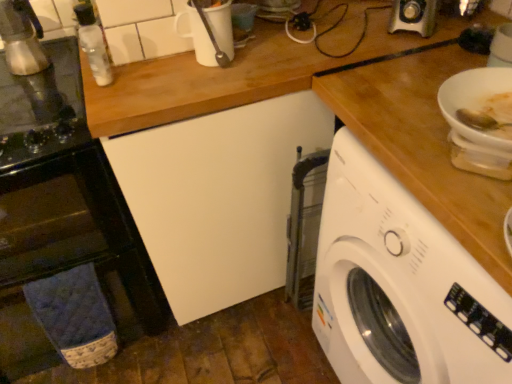
This screenshot has width=512, height=384. What do you see at coordinates (79, 236) in the screenshot?
I see `blue fabric oven towel at lower left` at bounding box center [79, 236].

In order to click on blue fabric oven towel at lower left in this screenshot , I will do `click(79, 236)`.

Locate an element on the screen. white plastic washing machine at right is located at coordinates (400, 286).

Find the location of a particular element. This screenshot has width=512, height=384. metallic silver espresso maker at left, arranged as the 2th appliance when ordered from the bottom is located at coordinates (22, 38).

In order to face metallic silver coffee maker at left, which is the 1th appliance from bottom to top, should I rotate leftwards or rightwards?

You should rotate left by 27.788 degrees.

At what (x,y) coordinates should I click in order to perform the action: click on blue fabric oven towel at lower left. Please return your answer as a coordinate pair (x, y). The image size is (512, 384). Looking at the image, I should click on (79, 236).

Can you see metallic silver espresso maker at left, arranged as the 2th appliance when ordered from the bottom, touching clear glass bottle at upper left?

No, metallic silver espresso maker at left, arranged as the 2th appliance when ordered from the bottom, is not with clear glass bottle at upper left.

Is point (20, 18) more distant than point (80, 29)?

Yes, it is behind point (80, 29).

What's the angular difference between metallic silver espresso maker at left, arranged as the 2th appliance when ordered from the bottom, and clear glass bottle at upper left's facing directions?

metallic silver espresso maker at left, arranged as the 2th appliance when ordered from the bottom, and clear glass bottle at upper left are facing 87.1 degrees away from each other.

Does metallic silver espresso maker at left, the first appliance in the top-to-bottom sequence, have a lesser width compared to clear glass bottle at upper left?

Incorrect, the width of metallic silver espresso maker at left, the first appliance in the top-to-bottom sequence, is not less than that of clear glass bottle at upper left.

In the scene shown: Which of these two, blue fabric oven towel at lower left or white matte bowl at upper right, stands taller?

blue fabric oven towel at lower left.

From a real-world perspective, is blue fabric oven towel at lower left under white matte bowl at upper right?

Yes, from a real-world perspective, blue fabric oven towel at lower left is below white matte bowl at upper right.

From the image's perspective, would you say blue fabric oven towel at lower left is positioned over white matte bowl at upper right?

Actually, blue fabric oven towel at lower left appears below white matte bowl at upper right in the image.

Considering the sizes of objects white plastic washing machine at right and metallic silver espresso maker at left, arranged as the 2th appliance when ordered from the bottom, in the image provided, who is thinner, white plastic washing machine at right or metallic silver espresso maker at left, arranged as the 2th appliance when ordered from the bottom,?

With smaller width is metallic silver espresso maker at left, arranged as the 2th appliance when ordered from the bottom.

Which appliance is the 2nd one when counting from the left side of the white plastic washing machine at right? Please provide its 2D coordinates.

[(22, 38)]

Would you say white plastic washing machine at right is to the left or to the right of metallic silver espresso maker at left, arranged as the 2th appliance when ordered from the bottom, in the picture?

In the image, white plastic washing machine at right appears on the right side of metallic silver espresso maker at left, arranged as the 2th appliance when ordered from the bottom.

Which is farther, (328, 337) or (23, 65)?

The point (328, 337) is more distant.

Are white plastic washing machine at right and metallic silver coffee maker at left, placed as the second appliance when sorted from top to bottom, located far from each other?

They are positioned close to each other.

Does point (447, 352) come in front of point (42, 81)?

That is True.

From the image's perspective, is white plastic washing machine at right located above or below metallic silver coffee maker at left, which is the 1th appliance from bottom to top?

Based on their image positions, white plastic washing machine at right is located beneath metallic silver coffee maker at left, which is the 1th appliance from bottom to top.

From the image's perspective, which object appears higher, white matte bowl at upper right or clear glass bottle at upper left?

clear glass bottle at upper left.

In terms of height, does white matte bowl at upper right look taller or shorter compared to clear glass bottle at upper left?

white matte bowl at upper right is shorter than clear glass bottle at upper left.

Measure the distance from white matte bowl at upper right to clear glass bottle at upper left.

A distance of 31.55 inches exists between white matte bowl at upper right and clear glass bottle at upper left.

How many degrees apart are the facing directions of white matte bowl at upper right and clear glass bottle at upper left?

The angle between the facing direction of white matte bowl at upper right and the facing direction of clear glass bottle at upper left is 9.02 degrees.

Is metallic silver coffee maker at left, which is the 1th appliance from bottom to top, oriented towards metallic silver espresso maker at left, the first appliance in the top-to-bottom sequence?

No, metallic silver coffee maker at left, which is the 1th appliance from bottom to top, is not turned towards metallic silver espresso maker at left, the first appliance in the top-to-bottom sequence.

Is point (75, 62) closer to camera compared to point (12, 9)?

No, it is not.

Does metallic silver coffee maker at left, which is the 1th appliance from bottom to top, appear on the right side of metallic silver espresso maker at left, arranged as the 2th appliance when ordered from the bottom?

Yes, metallic silver coffee maker at left, which is the 1th appliance from bottom to top, is to the right of metallic silver espresso maker at left, arranged as the 2th appliance when ordered from the bottom.

Considering the sizes of objects metallic silver coffee maker at left, placed as the second appliance when sorted from top to bottom, and metallic silver espresso maker at left, the first appliance in the top-to-bottom sequence, in the image provided, who is thinner, metallic silver coffee maker at left, placed as the second appliance when sorted from top to bottom, or metallic silver espresso maker at left, the first appliance in the top-to-bottom sequence,?

metallic silver espresso maker at left, the first appliance in the top-to-bottom sequence, is thinner.

Is white plastic washing machine at right far from blue fabric oven towel at lower left?

No, white plastic washing machine at right is not far away from blue fabric oven towel at lower left.

Locate an element on the screen. The image size is (512, 384). oven above the white plastic washing machine at right (from the image's perspective) is located at coordinates (79, 236).

From the picture: Is white plastic washing machine at right not inside blue fabric oven towel at lower left?

That's correct, white plastic washing machine at right is outside of blue fabric oven towel at lower left.

Find the location of a particular element. appliance above the clear glass bottle at upper left (from the image's perspective) is located at coordinates (22, 38).

Locate an element on the screen. oven that appears below the white matte bowl at upper right (from the image's perspective) is located at coordinates (79, 236).

From the image, which object appears to be nearer to metallic silver espresso maker at left, the first appliance in the top-to-bottom sequence, white matte bowl at upper right or blue fabric oven towel at lower left?

blue fabric oven towel at lower left lies closer to metallic silver espresso maker at left, the first appliance in the top-to-bottom sequence, than the other object.

When comparing their distances from white plastic washing machine at right, does metallic silver coffee maker at left, placed as the second appliance when sorted from top to bottom, or metallic silver espresso maker at left, the first appliance in the top-to-bottom sequence, seem closer?

Based on the image, metallic silver coffee maker at left, placed as the second appliance when sorted from top to bottom, appears to be nearer to white plastic washing machine at right.

When comparing their distances from white matte bowl at upper right, does metallic silver espresso maker at left, arranged as the 2th appliance when ordered from the bottom, or clear glass bottle at upper left seem further?

metallic silver espresso maker at left, arranged as the 2th appliance when ordered from the bottom, is positioned further to the anchor white matte bowl at upper right.

Based on the photo, which object lies further to the anchor point clear glass bottle at upper left, white plastic washing machine at right or metallic silver coffee maker at left, placed as the second appliance when sorted from top to bottom?

white plastic washing machine at right is further to clear glass bottle at upper left.

Considering their positions, is blue fabric oven towel at lower left positioned closer to white plastic washing machine at right than clear glass bottle at upper left?

blue fabric oven towel at lower left is positioned closer to the anchor white plastic washing machine at right.

Based on their spatial positions, is metallic silver coffee maker at left, placed as the second appliance when sorted from top to bottom, or metallic silver espresso maker at left, the first appliance in the top-to-bottom sequence, further from blue fabric oven towel at lower left?

metallic silver espresso maker at left, the first appliance in the top-to-bottom sequence.

Based on the photo, when comparing their distances from metallic silver espresso maker at left, the first appliance in the top-to-bottom sequence, does clear glass bottle at upper left or white plastic washing machine at right seem closer?

clear glass bottle at upper left is closer to metallic silver espresso maker at left, the first appliance in the top-to-bottom sequence.

Which object lies further to the anchor point white plastic washing machine at right, metallic silver espresso maker at left, arranged as the 2th appliance when ordered from the bottom, or metallic silver coffee maker at left, placed as the second appliance when sorted from top to bottom?

The object further to white plastic washing machine at right is metallic silver espresso maker at left, arranged as the 2th appliance when ordered from the bottom.

Identify the location of bottle between blue fabric oven towel at lower left and white plastic washing machine at right in the horizontal direction. The width and height of the screenshot is (512, 384). (93, 43).

The height and width of the screenshot is (384, 512). What are the coordinates of `appliance between metallic silver espresso maker at left, arranged as the 2th appliance when ordered from the bottom, and blue fabric oven towel at lower left vertically` in the screenshot? It's located at (42, 107).

Where is `appliance between metallic silver espresso maker at left, arranged as the 2th appliance when ordered from the bottom, and white plastic washing machine at right`? appliance between metallic silver espresso maker at left, arranged as the 2th appliance when ordered from the bottom, and white plastic washing machine at right is located at coordinates (42, 107).

The height and width of the screenshot is (384, 512). I want to click on bowl between clear glass bottle at upper left and white plastic washing machine at right, so [x=474, y=100].